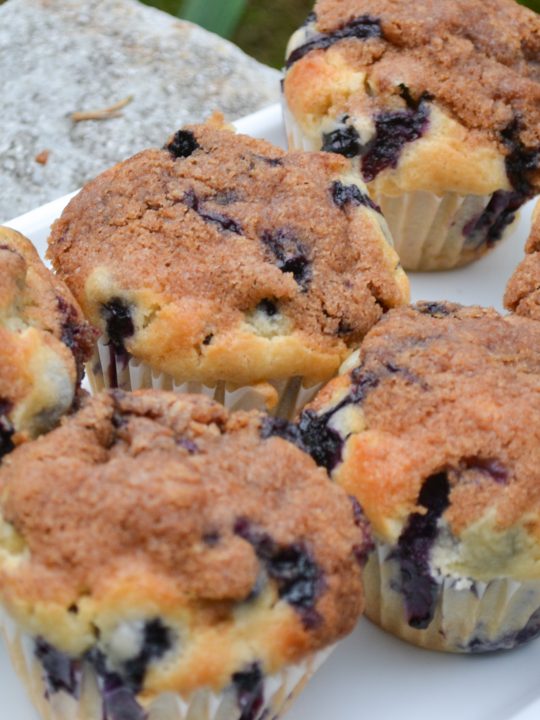
The image size is (540, 720). Identify the location of marble. (200, 63).